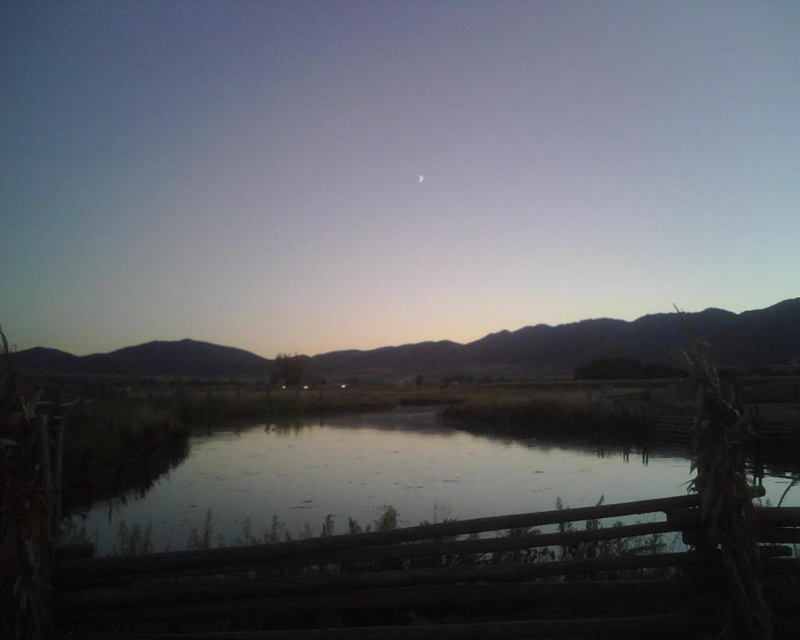
From the picture: You are standing in front of the landscape scene. You want to take a photo that includes both the smooth reflective water at center and the brown matte mountain at center. Which object should you focus on first to ensure both are in focus?

You should focus on the brown matte mountain at center first because it is farther away than the smooth reflective water at center, so focusing on the distant object will help both be in focus.

You are an artist planning to paint the landscape scene. You want to ensure the smooth reflective water at center and the brown matte mountain at center are proportionally accurate. Which object should you make wider in your painting?

The brown matte mountain at center should be made wider in the painting since it has a greater width compared to the smooth reflective water at center according to the description.